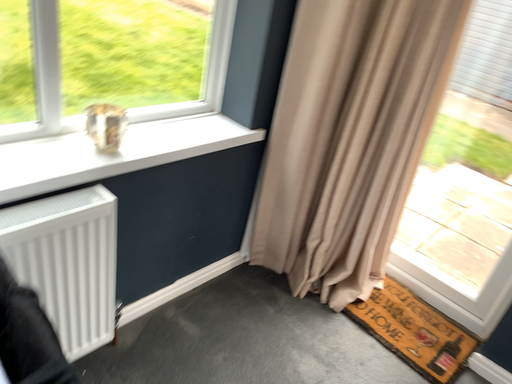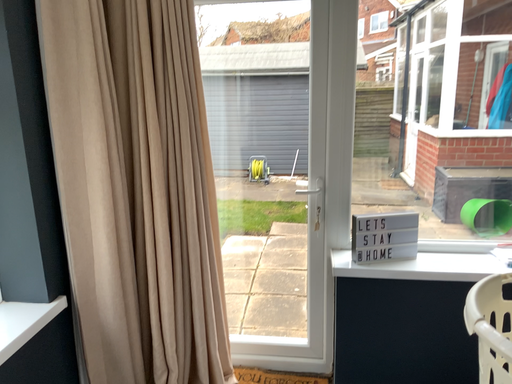
Question: Which way did the camera rotate in the video?

Choices:
 (A) rotated downward
 (B) rotated upward

Answer: (B)